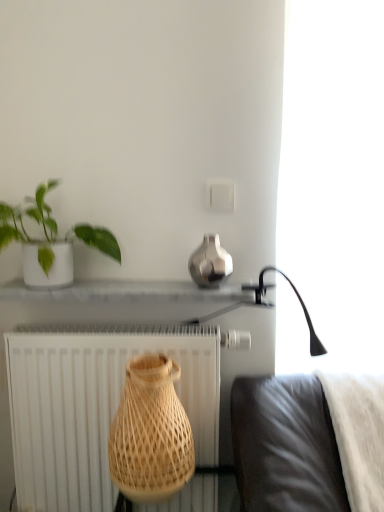
Question: From a real-world perspective, is white fluffy blanket at lower right under green matte plant at upper left?

Choices:
 (A) yes
 (B) no

Answer: (A)

Question: Can you confirm if white fluffy blanket at lower right is bigger than green matte plant at upper left?

Choices:
 (A) yes
 (B) no

Answer: (A)

Question: Is white fluffy blanket at lower right not near green matte plant at upper left?

Choices:
 (A) no
 (B) yes

Answer: (A)

Question: Is green matte plant at upper left completely or partially inside white fluffy blanket at lower right?

Choices:
 (A) yes
 (B) no

Answer: (B)

Question: Is white fluffy blanket at lower right taller than green matte plant at upper left?

Choices:
 (A) no
 (B) yes

Answer: (B)

Question: Is point (44, 242) closer or farther from the camera than point (180, 292)?

Choices:
 (A) farther
 (B) closer

Answer: (A)

Question: Considering the relative positions of green matte plant at upper left and white glossy shelf at center in the image provided, is green matte plant at upper left to the left or to the right of white glossy shelf at center?

Choices:
 (A) right
 (B) left

Answer: (B)

Question: From the image's perspective, is green matte plant at upper left located above or below white glossy shelf at center?

Choices:
 (A) above
 (B) below

Answer: (A)

Question: In terms of size, does green matte plant at upper left appear bigger or smaller than white glossy shelf at center?

Choices:
 (A) small
 (B) big

Answer: (B)

Question: Is point (347, 436) closer or farther from the camera than point (134, 485)?

Choices:
 (A) farther
 (B) closer

Answer: (A)

Question: From a real-world perspective, relative to natural wood vase at center, placed as the second vase when sorted from right to left, is white fluffy blanket at lower right vertically above or below?

Choices:
 (A) above
 (B) below

Answer: (B)

Question: In the image, is white fluffy blanket at lower right positioned in front of or behind natural wood vase at center, which is the first vase in bottom-to-top order?

Choices:
 (A) front
 (B) behind

Answer: (A)

Question: From the image's perspective, is white fluffy blanket at lower right located above or below natural wood vase at center, which ranks as the second vase in top-to-bottom order?

Choices:
 (A) below
 (B) above

Answer: (A)

Question: From the image's perspective, is white textured radiator at lower left positioned above or below natural wood vase at center, which is the first vase in bottom-to-top order?

Choices:
 (A) below
 (B) above

Answer: (A)

Question: From a real-world perspective, is white textured radiator at lower left positioned above or below natural wood vase at center, placed as the second vase when sorted from right to left?

Choices:
 (A) above
 (B) below

Answer: (B)